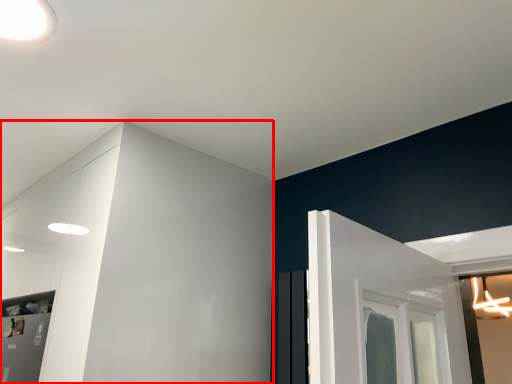
Question: From the image's perspective, considering the relative positions of dresser (annotated by the red box) and light in the image provided, where is dresser (annotated by the red box) located with respect to the staircase?

Choices:
 (A) above
 (B) below

Answer: (B)